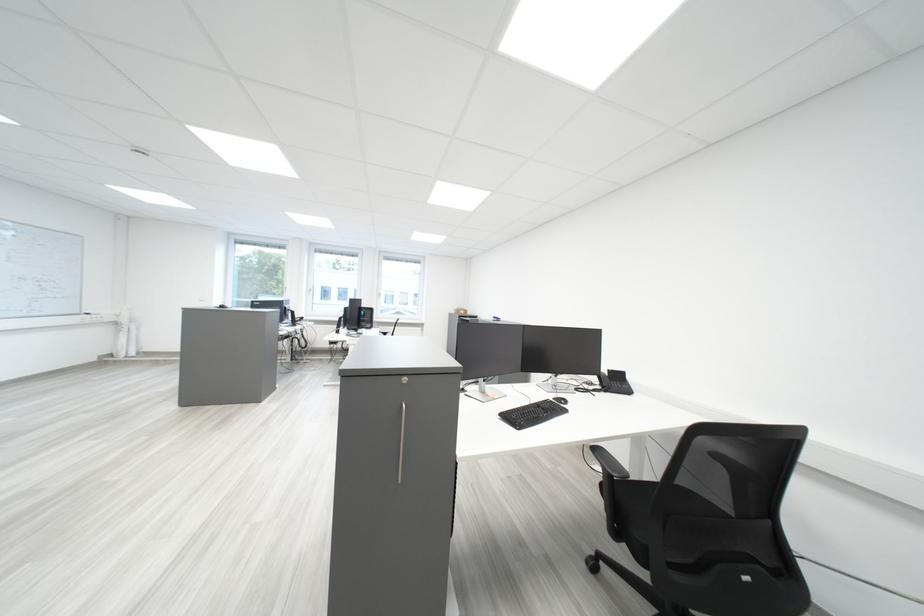
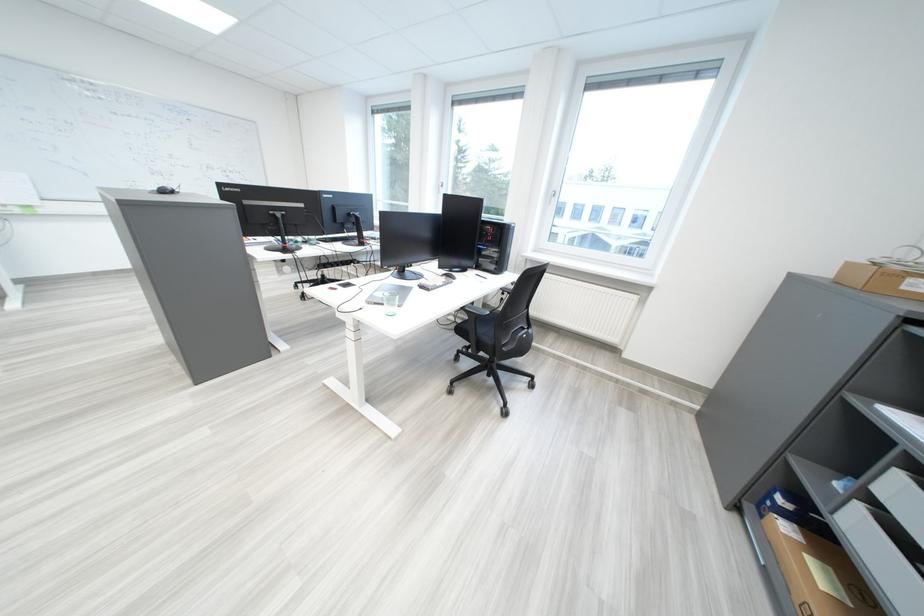
Where in the second image is the point corresponding to point 467,313 from the first image?

(839, 274)